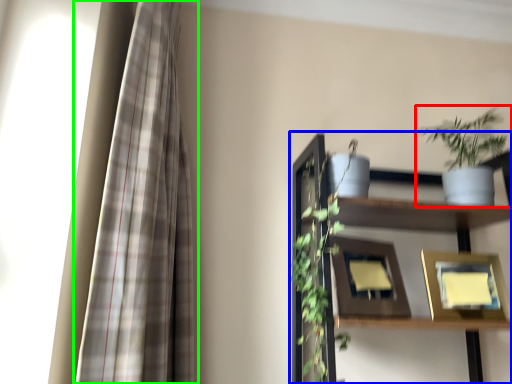
Question: Considering the real-world distances, which object is closest to houseplant (highlighted by a red box)? shelf (highlighted by a blue box) or curtain (highlighted by a green box).

Choices:
 (A) shelf
 (B) curtain

Answer: (A)